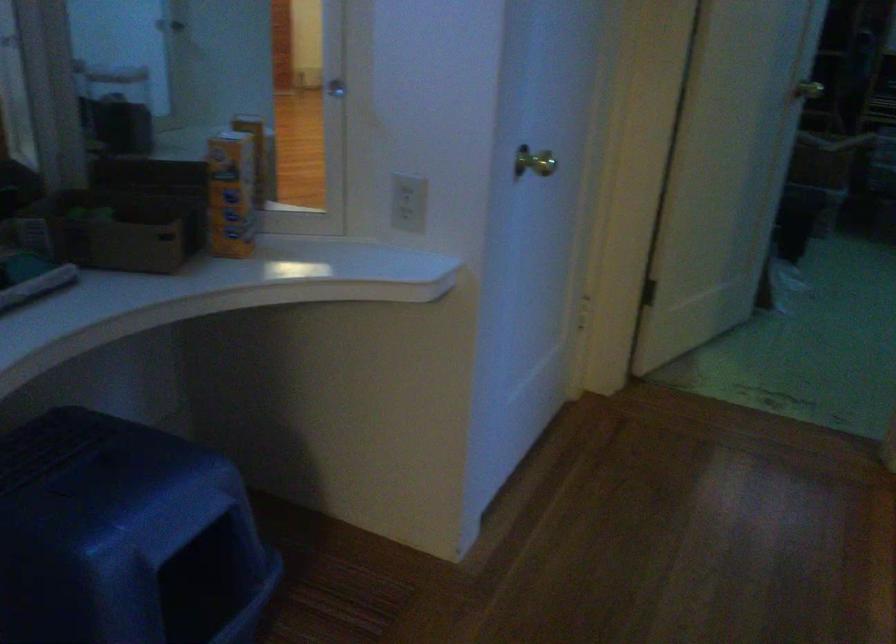
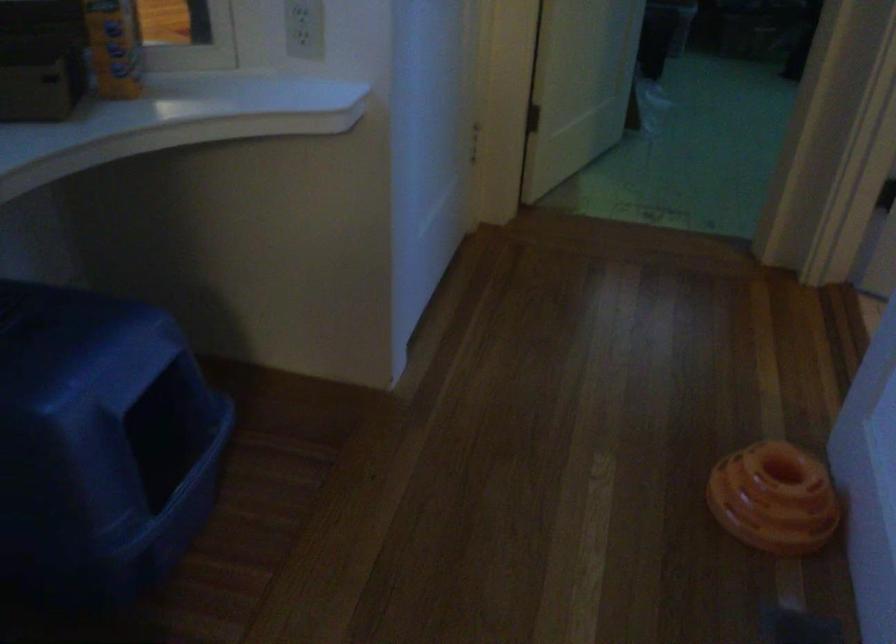
Locate, in the second image, the point that corresponds to (x=221, y=212) in the first image.

(114, 46)